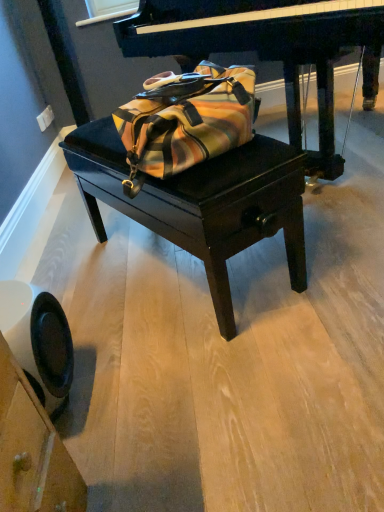
Identify the location of vacant area situated below velvet black table at center (from a real-world perspective). This screenshot has height=512, width=384. (180, 268).